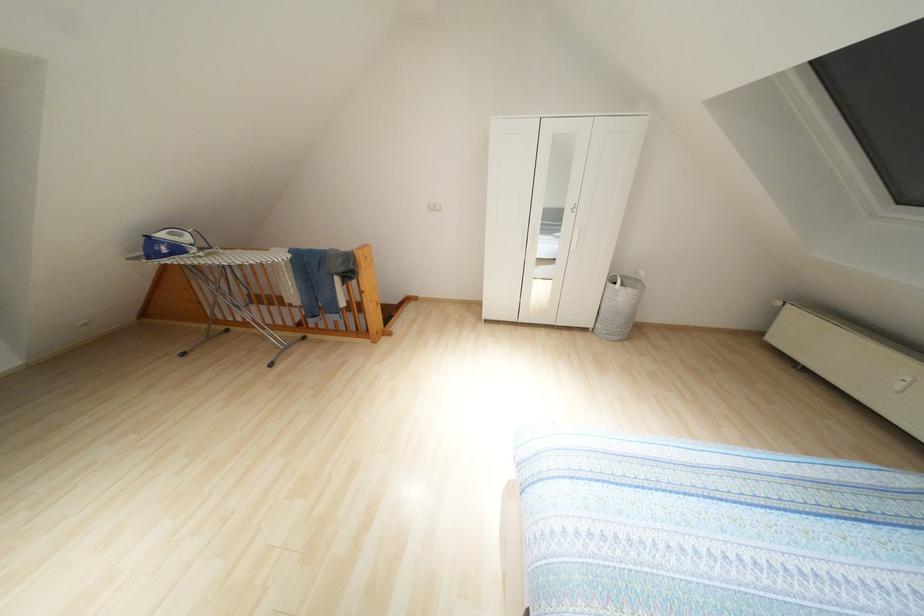
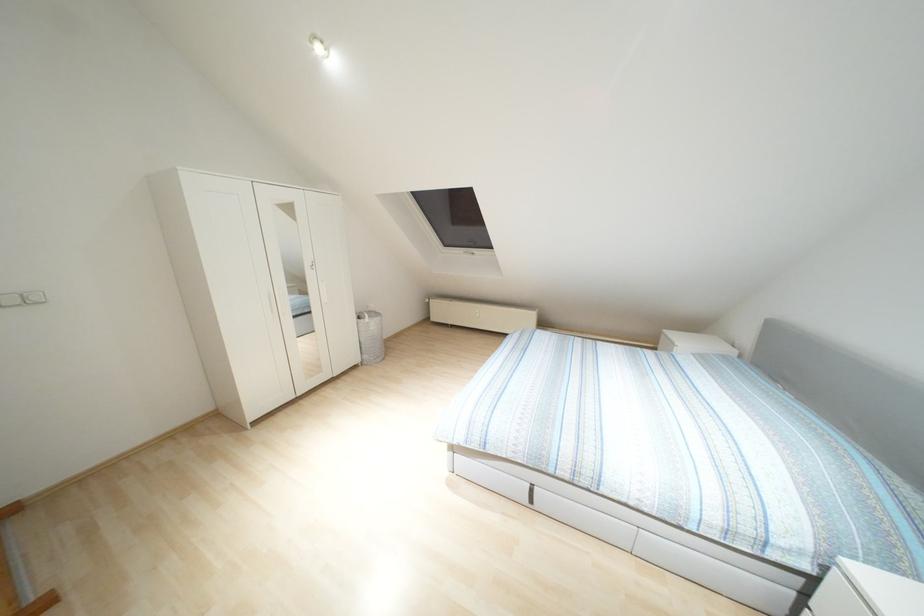
Question: The camera is either moving clockwise (left) or counter-clockwise (right) around the object. The first image is from the beginning of the video and the second image is from the end. Is the camera moving left or right when shooting the video?

Choices:
 (A) Left
 (B) Right

Answer: (A)